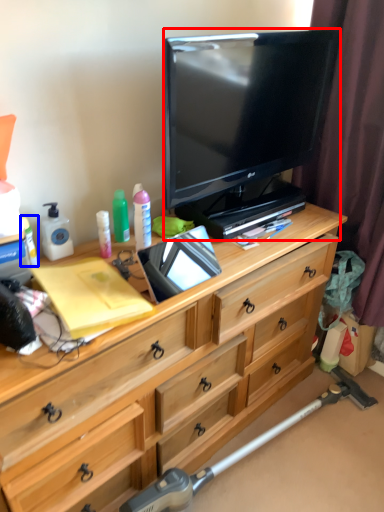
Question: Which object appears farthest to the camera in this image, television (highlighted by a red box) or toiletry (highlighted by a blue box)?

Choices:
 (A) television
 (B) toiletry

Answer: (B)